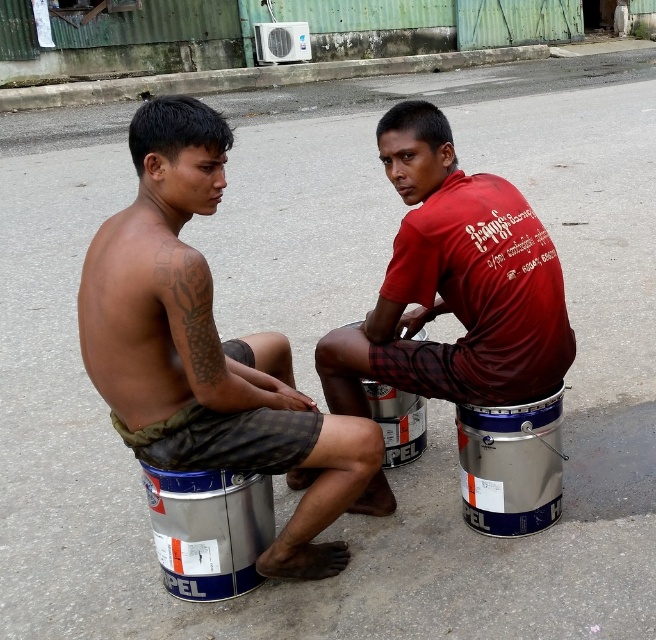
You are a photographer wanting to capture both the matte black torso at left and the matte red shirt at center in a single frame. Given their sizes, which subject should you focus on to ensure both fit naturally without cropping?

Since the matte black torso at left is larger than the matte red shirt at center, you should focus on the matte black torso at left to accommodate its size while still including the matte red shirt at center in the frame.

You are a photographer positioned behind the two people in the image. You want to take a photo that clearly shows both the matte black torso at left and the matte red shirt at center. Which person should you focus on first to ensure both are in sharp focus?

You should focus on the matte black torso at left first because it is closer to the viewer than the matte red shirt at center, ensuring both will be in focus when using a shallow depth of field.